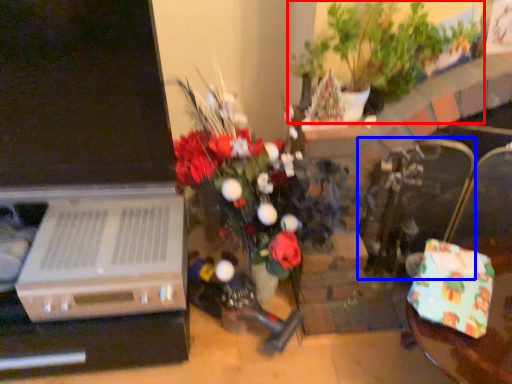
Question: Which object is closer to the camera taking this photo, houseplant (highlighted by a red box) or armchair (highlighted by a blue box)?

Choices:
 (A) houseplant
 (B) armchair

Answer: (A)